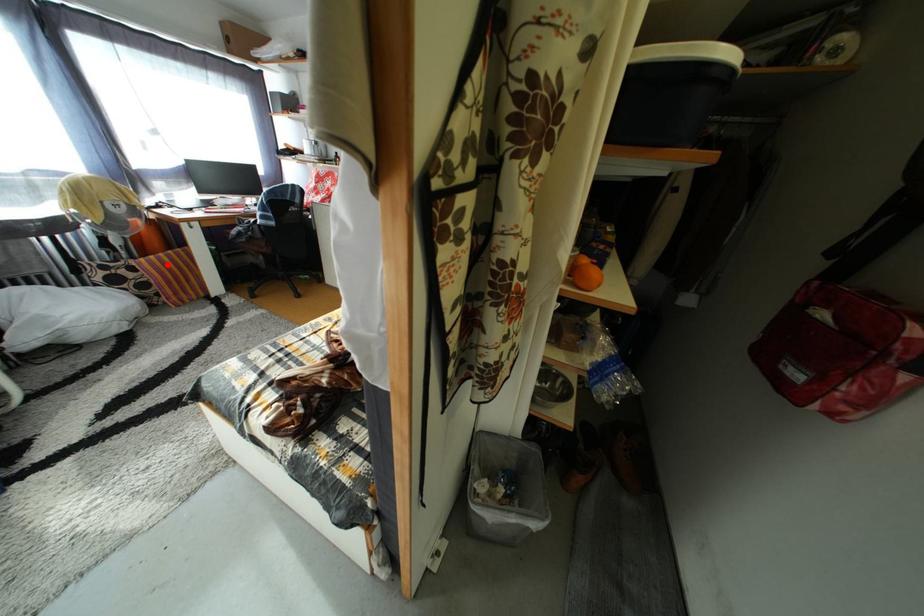
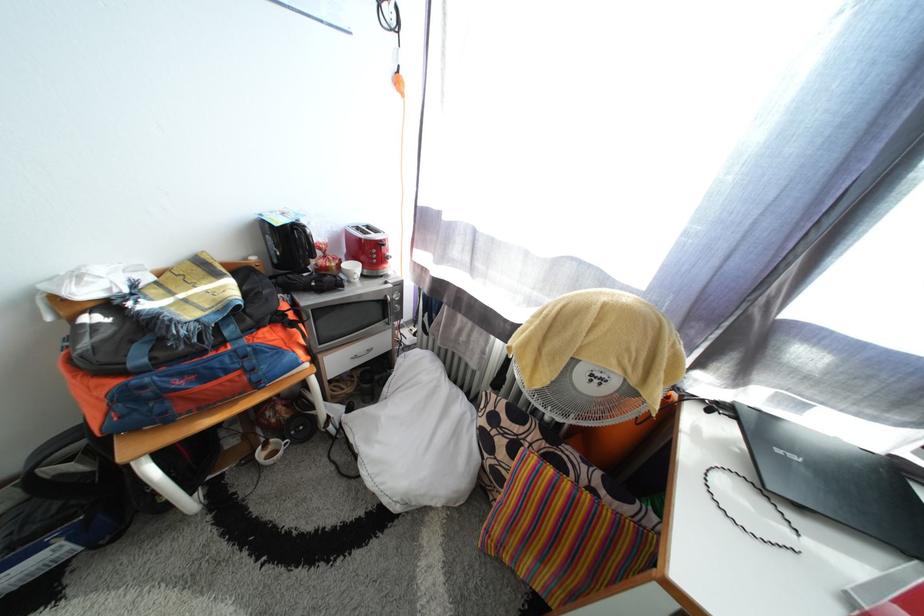
Find the pixel in the second image that matches the highlighted location in the first image.

(563, 493)